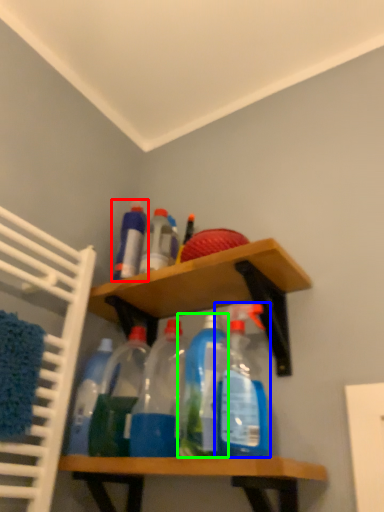
Question: Considering the real-world distances, which object is farthest from bottle (highlighted by a red box)? bottle (highlighted by a blue box) or bottle (highlighted by a green box)?

Choices:
 (A) bottle
 (B) bottle

Answer: (A)